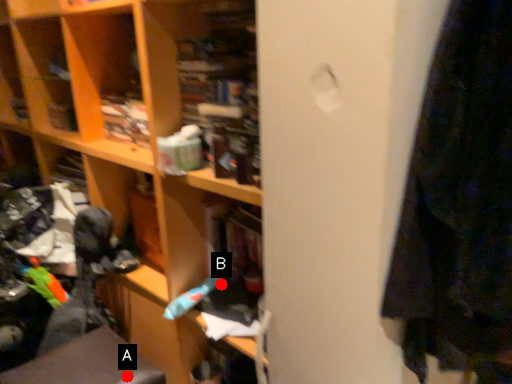
Question: Two points are circled on the image, labeled by A and B beside each circle. Which of the following is the farthest from the observer?

Choices:
 (A) A is further
 (B) B is further

Answer: (B)